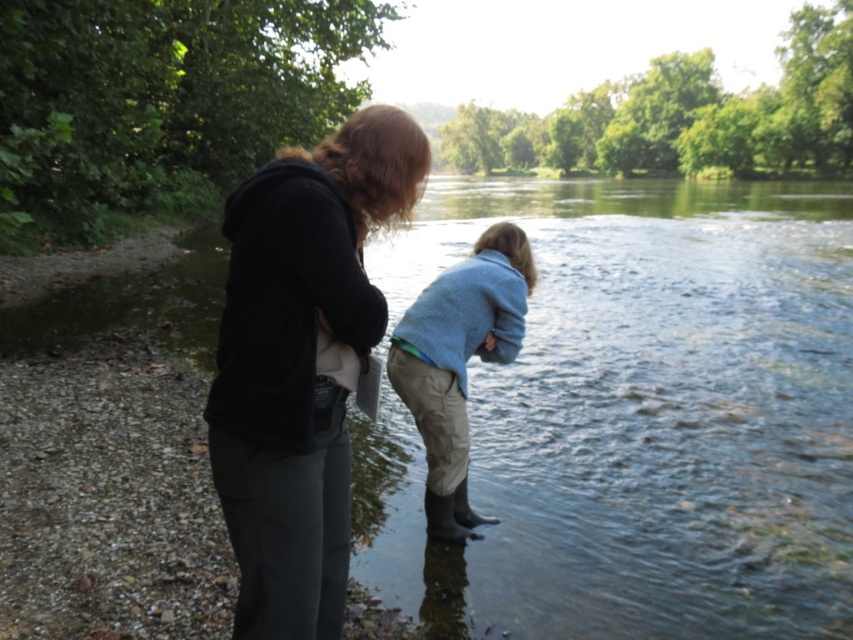
Is matte black hoodie at center above light blue sweater at center?

Yes, matte black hoodie at center is above light blue sweater at center.

In the scene shown: Who is lower down, matte black hoodie at center or light blue sweater at center?

light blue sweater at center is lower down.

Describe the element at coordinates (300, 364) in the screenshot. I see `matte black hoodie at center` at that location.

Identify the location of matte black hoodie at center. (300, 364).